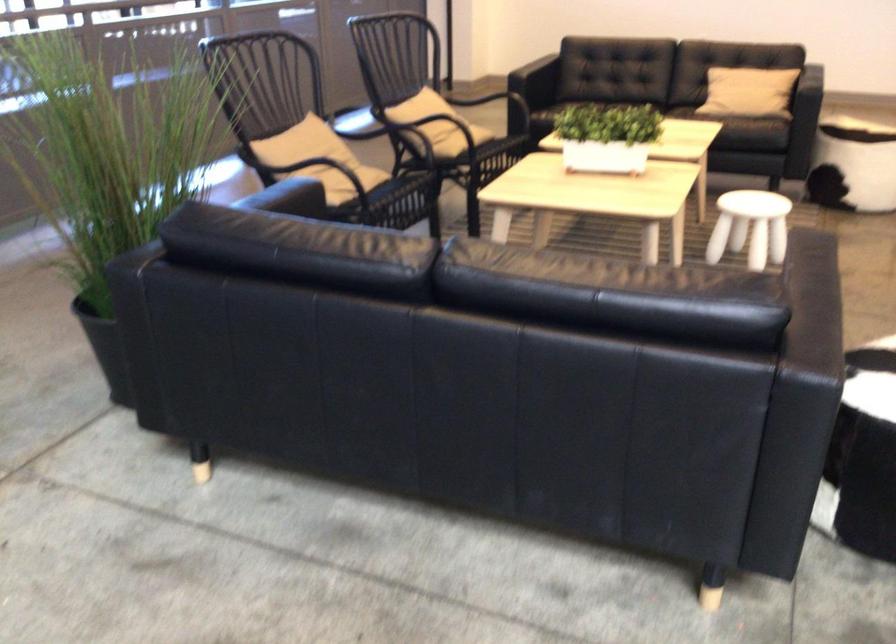
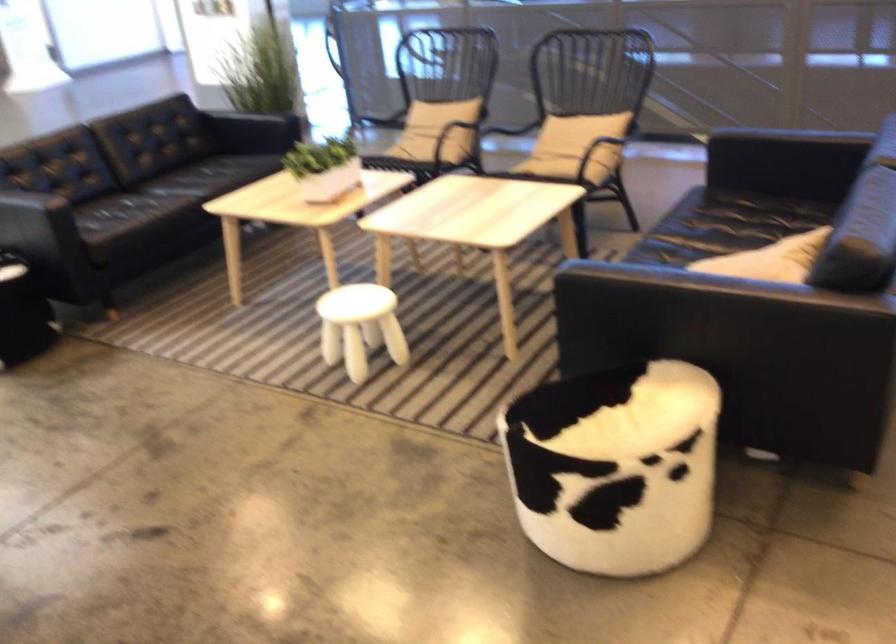
Where in the second image is the point corresponding to (x=488, y=129) from the first image?

(552, 160)